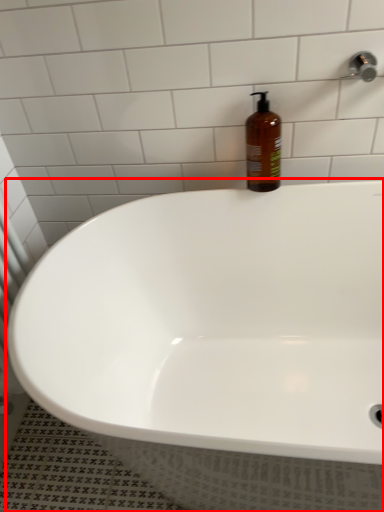
Question: From the image's perspective, where is bathtub (annotated by the red box) located in relation to bottle in the image?

Choices:
 (A) above
 (B) below

Answer: (B)